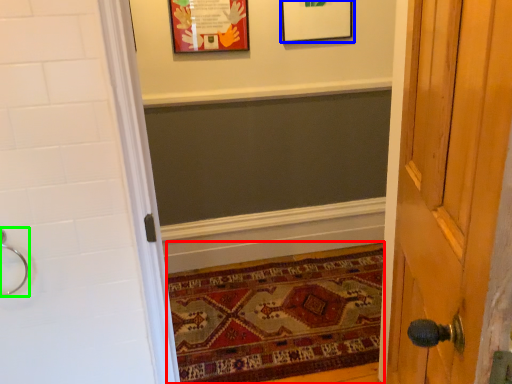
Question: Which object is the closest to the mat (highlighted by a red box)? Choose among these: picture frame (highlighted by a blue box) or door handle (highlighted by a green box).

Choices:
 (A) picture frame
 (B) door handle

Answer: (B)